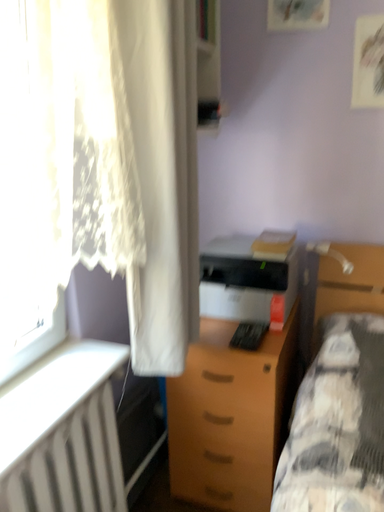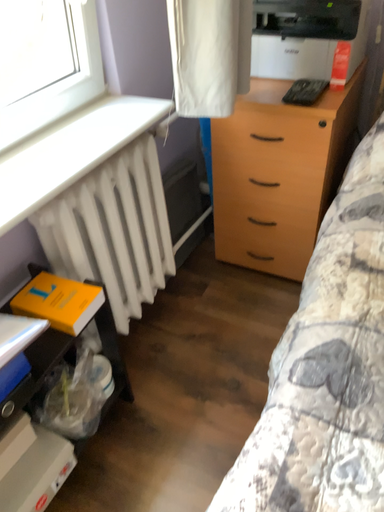
Question: How did the camera likely rotate when shooting the video?

Choices:
 (A) rotated upward
 (B) rotated downward

Answer: (B)